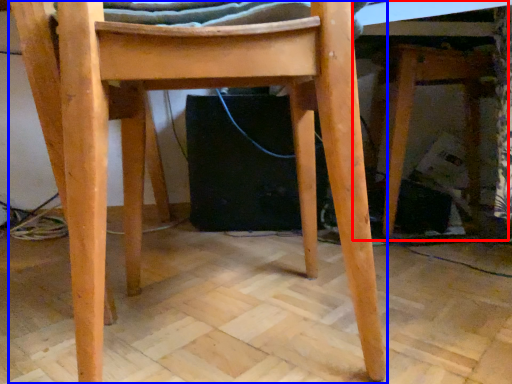
Question: Which point is further to the camera, table (highlighted by a red box) or chair (highlighted by a blue box)?

Choices:
 (A) table
 (B) chair

Answer: (A)